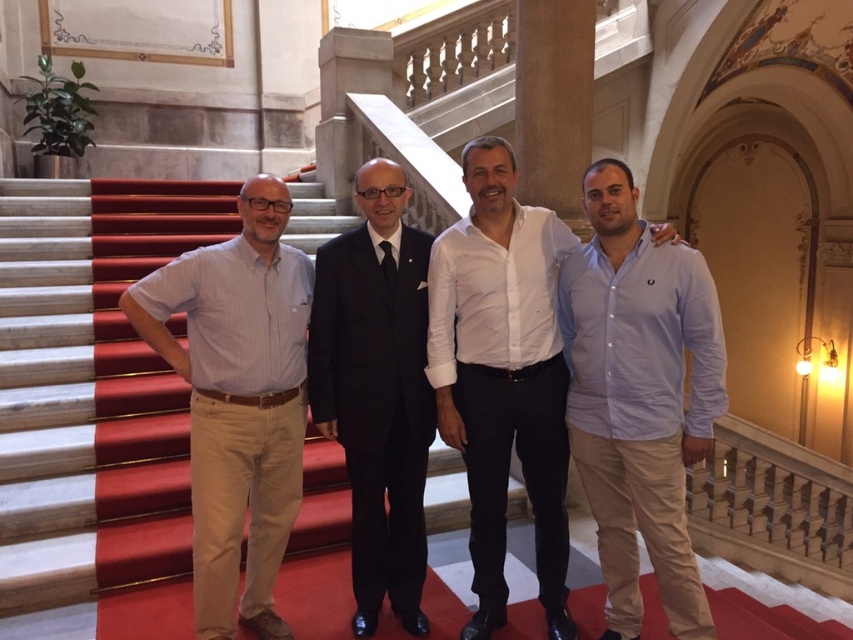
Question: Which point is closer to the camera?

Choices:
 (A) white cotton shirt at center
 (B) black suit at center
 (C) light blue striped shirt at left

Answer: (C)

Question: Which point is farther from the camera taking this photo?

Choices:
 (A) (572, 634)
 (B) (665, 314)
 (C) (160, 346)

Answer: (A)

Question: Is light blue striped shirt at left to the right of white cotton shirt at center from the viewer's perspective?

Choices:
 (A) yes
 (B) no

Answer: (B)

Question: Is white cotton shirt at center to the left of white marble pillar at center from the viewer's perspective?

Choices:
 (A) no
 (B) yes

Answer: (B)

Question: Which point is closer to the camera?

Choices:
 (A) (492, 189)
 (B) (164, 320)
 (C) (357, 388)

Answer: (B)

Question: From the image, what is the correct spatial relationship of black suit at center in relation to white marble pillar at center?

Choices:
 (A) right
 (B) left

Answer: (B)